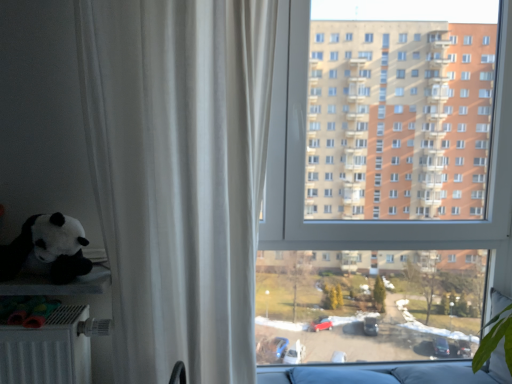
Question: Is transparent glass window at center in front of or behind matte black plush panda at left in the image?

Choices:
 (A) front
 (B) behind

Answer: (B)

Question: Is point (293, 74) positioned closer to the camera than point (5, 274)?

Choices:
 (A) closer
 (B) farther

Answer: (B)

Question: Which object is positioned closest to the white sheer curtain at left?

Choices:
 (A) matte black plush panda at left
 (B) transparent glass window at center

Answer: (A)

Question: Which object is the closest to the matte black plush panda at left?

Choices:
 (A) transparent glass window at center
 (B) white sheer curtain at left

Answer: (B)